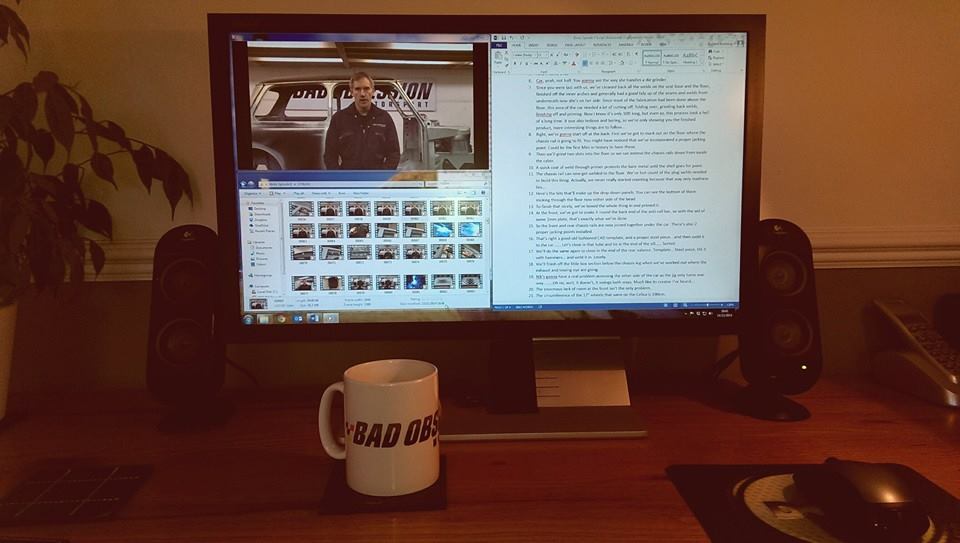
Where is `coaster`? coaster is located at coordinates (346, 504).